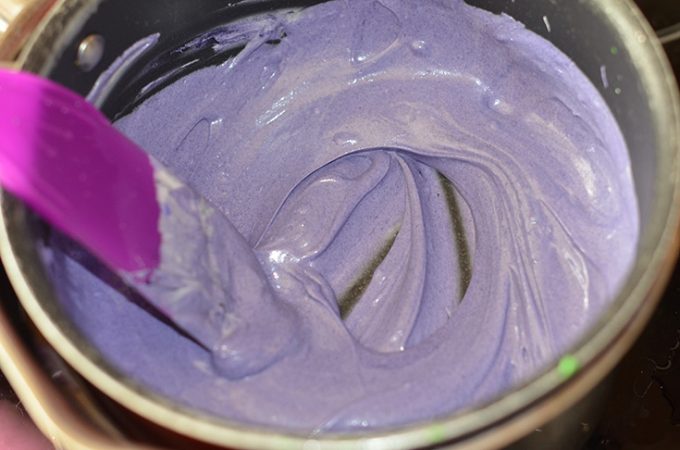
The height and width of the screenshot is (450, 680). Find the location of `pot`. pot is located at coordinates (136, 24).